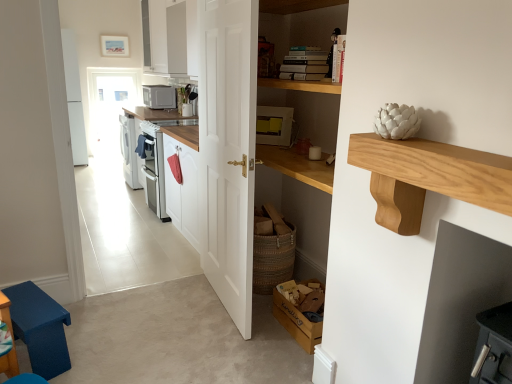
At what (x,y) coordinates should I click in order to perform the action: click on vacant space positioned to the left of wooden cardboard box at lower center. Please return your answer as a coordinate pair (x, y). Looking at the image, I should click on (264, 331).